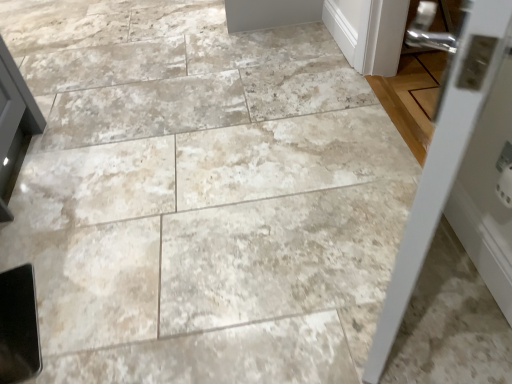
Question: Considering the relative positions of white painted wood door at upper right, positioned as the 1th door in back-to-front order, and white glossy door at right, the 2th door in the back-to-front sequence, in the image provided, is white painted wood door at upper right, positioned as the 1th door in back-to-front order, to the right of white glossy door at right, the 2th door in the back-to-front sequence, from the viewer's perspective?

Choices:
 (A) no
 (B) yes

Answer: (B)

Question: Considering the relative sizes of white painted wood door at upper right, which is the second door from front to back, and white glossy door at right, the first door from the front, in the image provided, is white painted wood door at upper right, which is the second door from front to back, bigger than white glossy door at right, the first door from the front,?

Choices:
 (A) no
 (B) yes

Answer: (A)

Question: Does white painted wood door at upper right, positioned as the 1th door in back-to-front order, contain white glossy door at right, the first door from the front?

Choices:
 (A) no
 (B) yes

Answer: (A)

Question: From the image's perspective, would you say white painted wood door at upper right, which is counted as the 2th door, starting from the bottom, is shown under white glossy door at right, the first door from the front?

Choices:
 (A) no
 (B) yes

Answer: (A)

Question: Is white painted wood door at upper right, arranged as the 1th door when viewed from the top, placed right next to white glossy door at right, acting as the first door starting from the bottom?

Choices:
 (A) no
 (B) yes

Answer: (A)

Question: Is white painted wood door at upper right, which is counted as the 2th door, starting from the bottom, not near white glossy door at right, acting as the first door starting from the bottom?

Choices:
 (A) no
 (B) yes

Answer: (B)

Question: Would you say white glossy door at right, the first door from the front, is a long distance from white painted wood door at upper right, positioned as the 1th door in back-to-front order?

Choices:
 (A) yes
 (B) no

Answer: (A)

Question: Is white glossy door at right, the first door from the front, taller than white painted wood door at upper right, which is the second door from front to back?

Choices:
 (A) yes
 (B) no

Answer: (A)

Question: From the image's perspective, would you say white glossy door at right, which is the second door from top to bottom, is shown under white painted wood door at upper right, positioned as the 1th door in back-to-front order?

Choices:
 (A) no
 (B) yes

Answer: (B)

Question: From a real-world perspective, does white glossy door at right, acting as the first door starting from the bottom, sit lower than white painted wood door at upper right, positioned as the 1th door in back-to-front order?

Choices:
 (A) yes
 (B) no

Answer: (B)

Question: From a real-world perspective, is white glossy door at right, the 2th door in the back-to-front sequence, over white painted wood door at upper right, which is the second door from front to back?

Choices:
 (A) no
 (B) yes

Answer: (B)

Question: Is the position of white glossy door at right, the 2th door in the back-to-front sequence, more distant than that of white painted wood door at upper right, which is the second door from front to back?

Choices:
 (A) yes
 (B) no

Answer: (B)

Question: Is white glossy door at right, acting as the first door starting from the bottom, taller or shorter than white painted wood door at upper right, which is the second door from front to back?

Choices:
 (A) tall
 (B) short

Answer: (A)